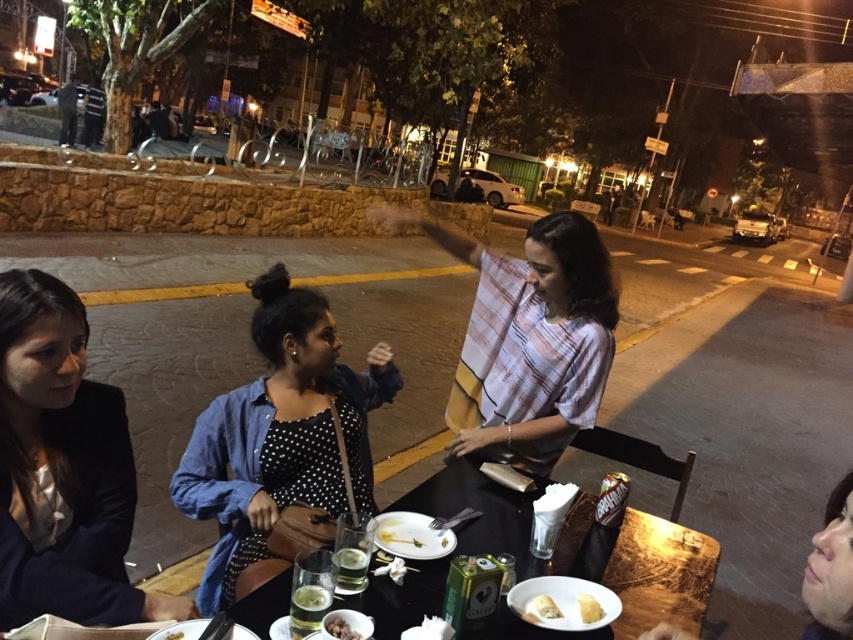
You are a waiter at the outdoor dining scene. A customer asks if the translucent glass at table center is blocking their view of the white creamy bread at lower center. Based on the scene description, how would you respond?

The translucent glass at table center is in front of the white creamy bread at lower center, so it might block the view slightly depending on the angle, but since the glass is translucent, they can still see through it.

You are a photographer standing at the camera position. You want to take a closeup of the polka dot blouse at center without moving the camera. Is it possible to zoom in enough to capture the entire blouse in focus?

The polka dot blouse at center is 1.40 meters from the camera. If the camera has sufficient zoom capabilities to focus on objects at that distance, then yes, it can be captured in focus. However, if the zoom range is limited, it might require adjusting the focus settings or using a higher zoom lens to ensure clarity.

You are a waiter at the outdoor dining scene. You need to place a new menu on the table between the translucent glass at table center and the white creamy bread at lower center. Where should you place it to be exactly between them?

The translucent glass at table center is positioned on the left side of white creamy bread at lower center, so placing the menu between them would require placing it to the right of the translucent glass at table center and to the left of the white creamy bread at lower center.